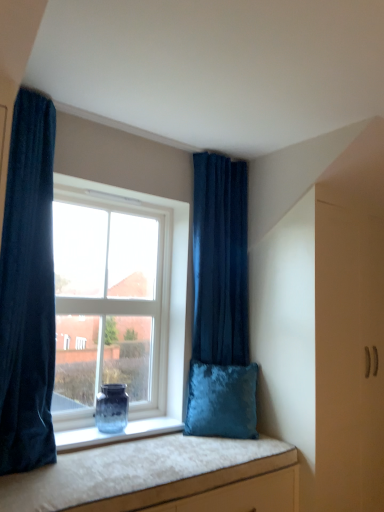
Identify the location of vacant space underneath velvet dark blue curtain at left, positioned as the 1th curtain in front-to-back order (from a real-world perspective). This screenshot has width=384, height=512. (33, 473).